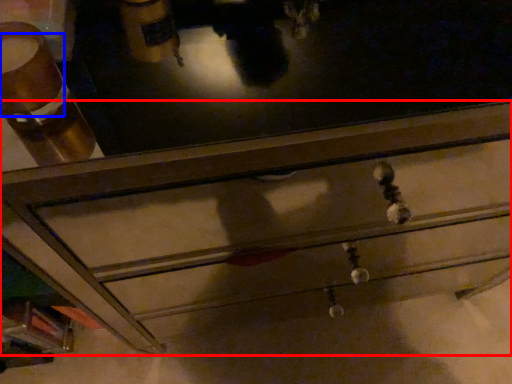
Question: Which object appears closest to the camera in this image, chest of drawers (highlighted by a red box) or beverage (highlighted by a blue box)?

Choices:
 (A) chest of drawers
 (B) beverage

Answer: (B)